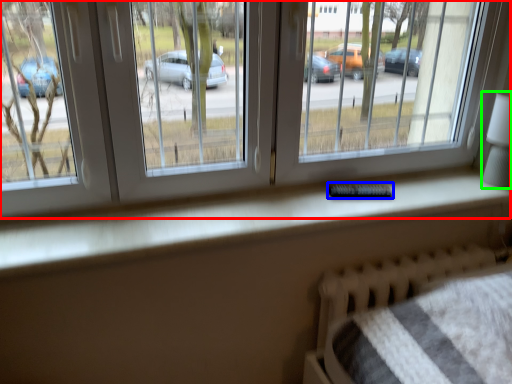
Question: Which object is the farthest from window (highlighted by a red box)? Choose among these: remote (highlighted by a blue box) or table lamp (highlighted by a green box).

Choices:
 (A) remote
 (B) table lamp

Answer: (A)